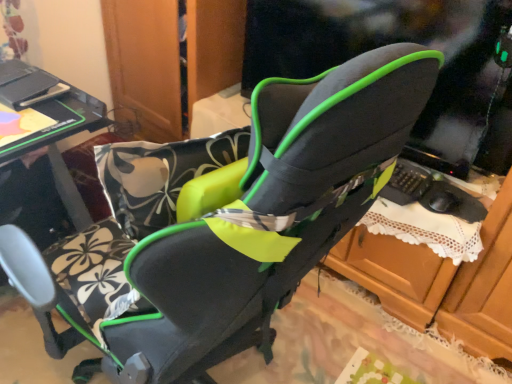
Question: Should I look upward or downward to see black glossy table at left?

Choices:
 (A) down
 (B) up

Answer: (B)

Question: Is black glossy table at left positioned with its back to black fabric dresser at center?

Choices:
 (A) yes
 (B) no

Answer: (B)

Question: Is black glossy table at left at the right side of black fabric dresser at center?

Choices:
 (A) no
 (B) yes

Answer: (A)

Question: Considering the relative sizes of black glossy table at left and black fabric dresser at center in the image provided, is black glossy table at left shorter than black fabric dresser at center?

Choices:
 (A) yes
 (B) no

Answer: (B)

Question: Is the position of black glossy table at left less distant than that of black fabric dresser at center?

Choices:
 (A) yes
 (B) no

Answer: (A)

Question: Does black glossy table at left have a lesser width compared to black fabric dresser at center?

Choices:
 (A) yes
 (B) no

Answer: (A)

Question: From the image's perspective, would you say black glossy table at left is shown under black fabric dresser at center?

Choices:
 (A) yes
 (B) no

Answer: (A)

Question: Is black fabric dresser at center at the left side of black glossy table at left?

Choices:
 (A) yes
 (B) no

Answer: (B)

Question: Is black glossy table at left at the back of black fabric dresser at center?

Choices:
 (A) yes
 (B) no

Answer: (B)

Question: Is black fabric dresser at center to the right of black glossy table at left from the viewer's perspective?

Choices:
 (A) no
 (B) yes

Answer: (B)

Question: Is black fabric dresser at center bigger than black glossy table at left?

Choices:
 (A) yes
 (B) no

Answer: (A)

Question: Can we say black fabric dresser at center lies outside black glossy table at left?

Choices:
 (A) no
 (B) yes

Answer: (B)

Question: Could black glossy table at left be considered to be inside black fabric dresser at center?

Choices:
 (A) no
 (B) yes

Answer: (A)

Question: Is point (52, 135) closer or farther from the camera than point (138, 18)?

Choices:
 (A) farther
 (B) closer

Answer: (B)